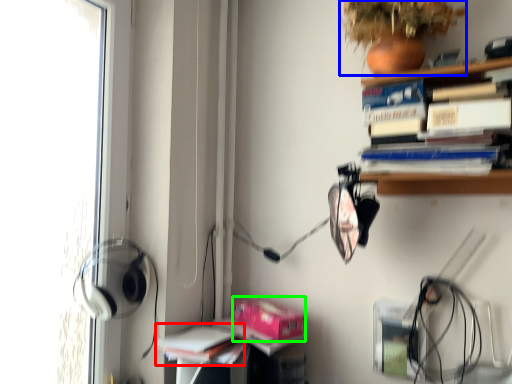
Question: Which is farther away from book (highlighted by a red box)? plant (highlighted by a blue box) or paperback book (highlighted by a green box)?

Choices:
 (A) plant
 (B) paperback book

Answer: (A)